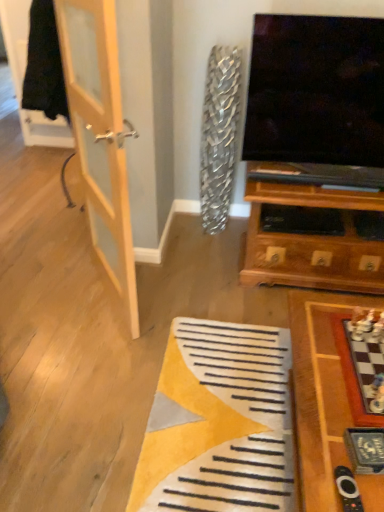
At what (x,y) coordinates should I click in order to perform the action: click on empty space that is to the right of light wood door at left. Please return your answer as a coordinate pair (x, y). The image size is (384, 512). Looking at the image, I should click on (186, 289).